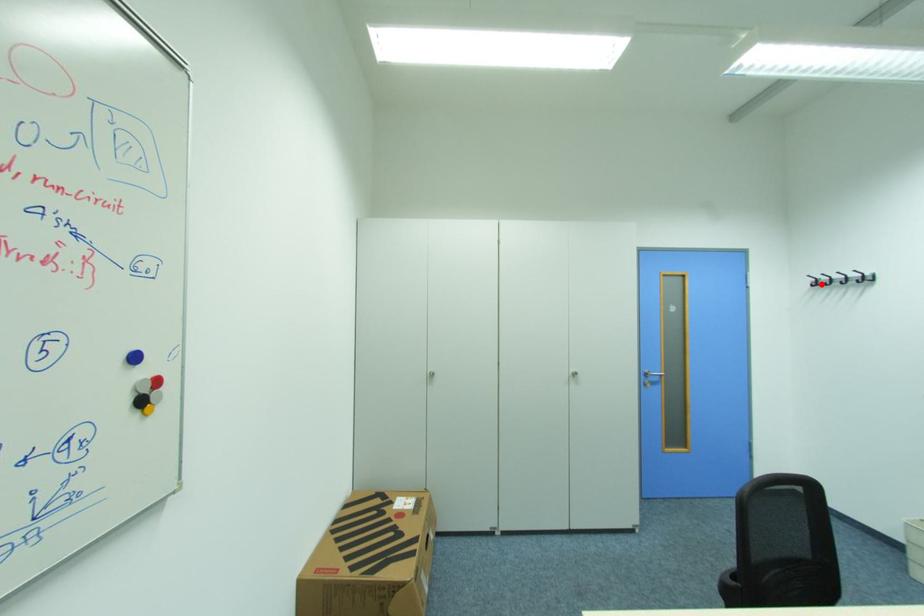
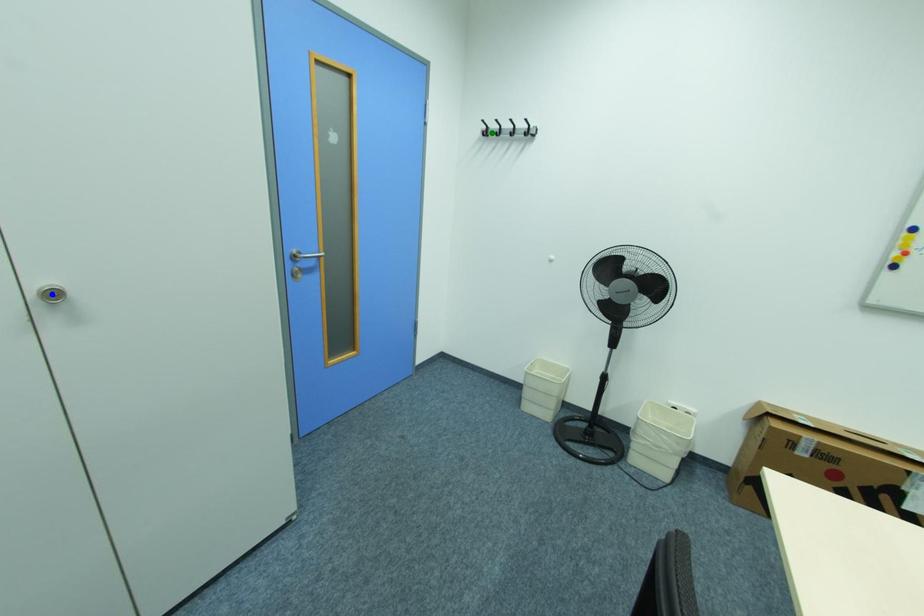
Question: I am providing you with two images of the same scene from different viewpoints. A red point is marked on the first image. You are given multiple points on the second image. In image 2, which mark is for the same physical point as the one in image 1?

Choices:
 (A) green point
 (B) yellow point
 (C) blue point

Answer: (A)